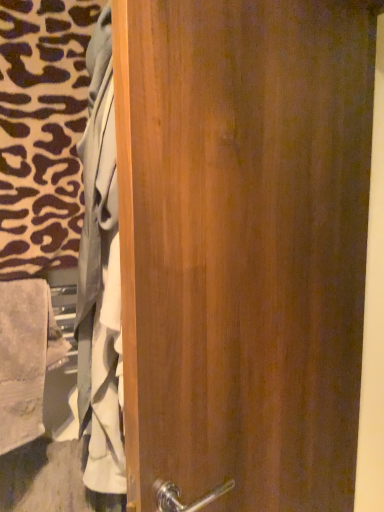
Question: Should I look upward or downward to see wooden door at center?

Choices:
 (A) down
 (B) up

Answer: (A)